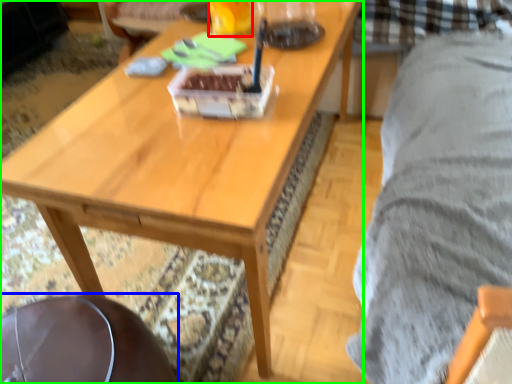
Question: Which object is positioned farthest from beverage (highlighted by a red box)? Select from swivel chair (highlighted by a blue box) and coffee table (highlighted by a green box).

Choices:
 (A) swivel chair
 (B) coffee table

Answer: (A)